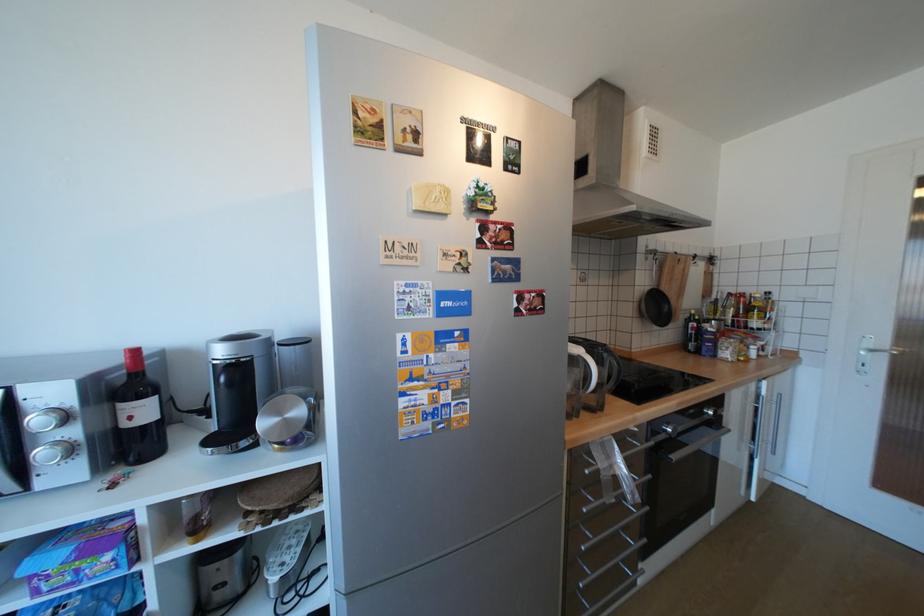
Describe the element at coordinates (775, 423) in the screenshot. This screenshot has width=924, height=616. I see `the vertical cabinet handle` at that location.